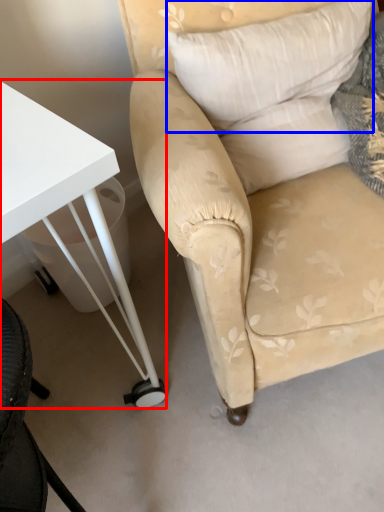
Question: Which object is closer to the camera taking this photo, table (highlighted by a red box) or pillow (highlighted by a blue box)?

Choices:
 (A) table
 (B) pillow

Answer: (A)